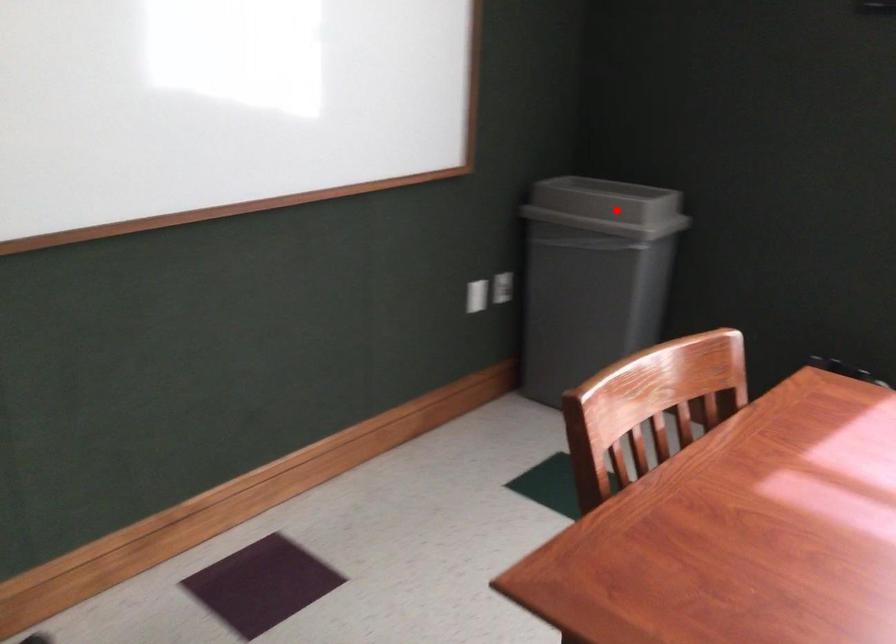
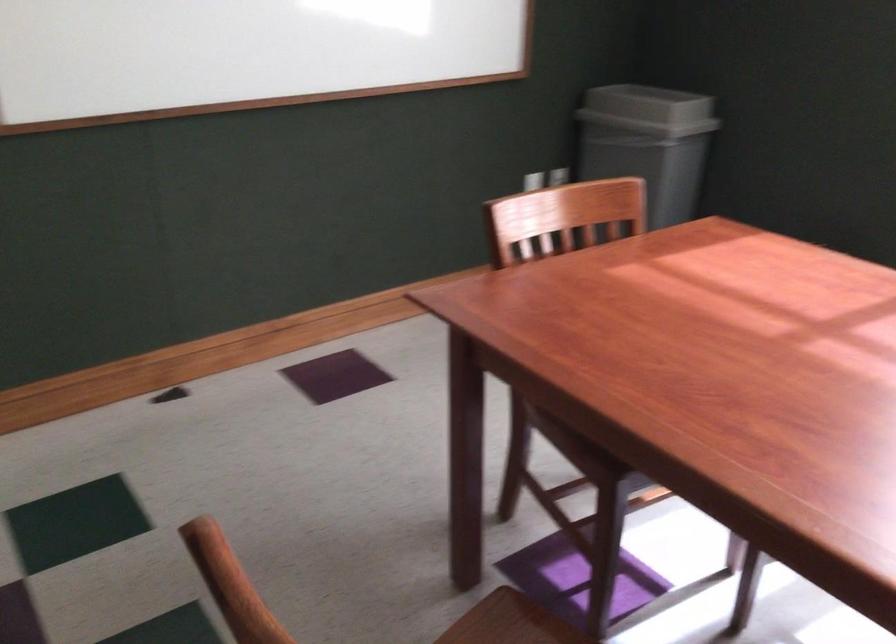
Question: I am providing you with two images of the same scene from different viewpoints. In image1, a red point is highlighted. Considering the same 3D point in image2, which of the following is correct?

Choices:
 (A) It is closer
 (B) It is farther

Answer: (B)